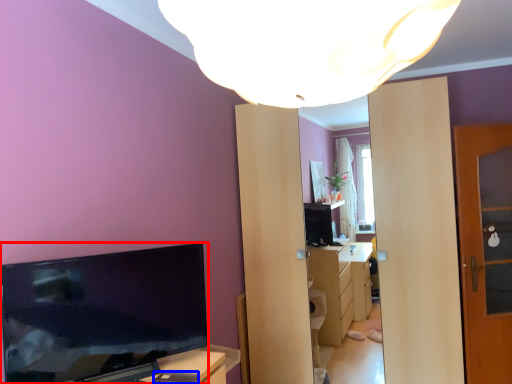
Question: Which point is further to the camera, television (highlighted by a red box) or mobile phone (highlighted by a blue box)?

Choices:
 (A) television
 (B) mobile phone

Answer: (B)